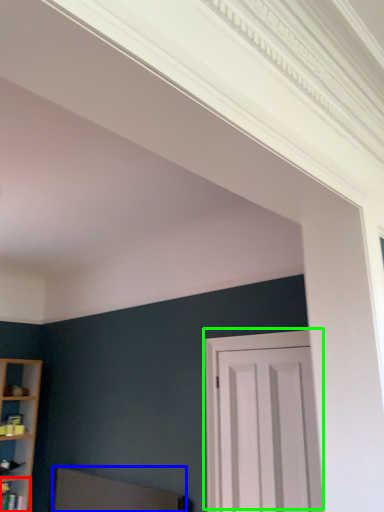
Question: Based on their relative distances, which object is nearer to shelf (highlighted by a red box)? Choose from swivel chair (highlighted by a blue box) and door (highlighted by a green box).

Choices:
 (A) swivel chair
 (B) door

Answer: (A)